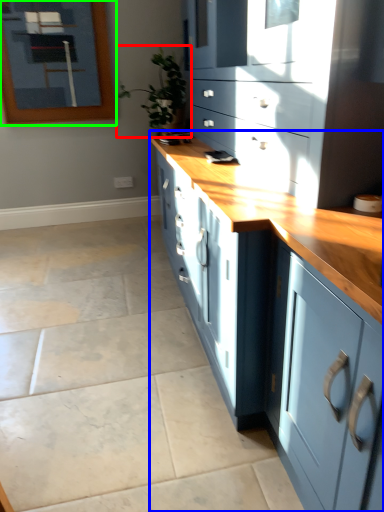
Question: Which is farther away from houseplant (highlighted by a red box)? cabinetry (highlighted by a blue box) or picture frame (highlighted by a green box)?

Choices:
 (A) cabinetry
 (B) picture frame

Answer: (A)